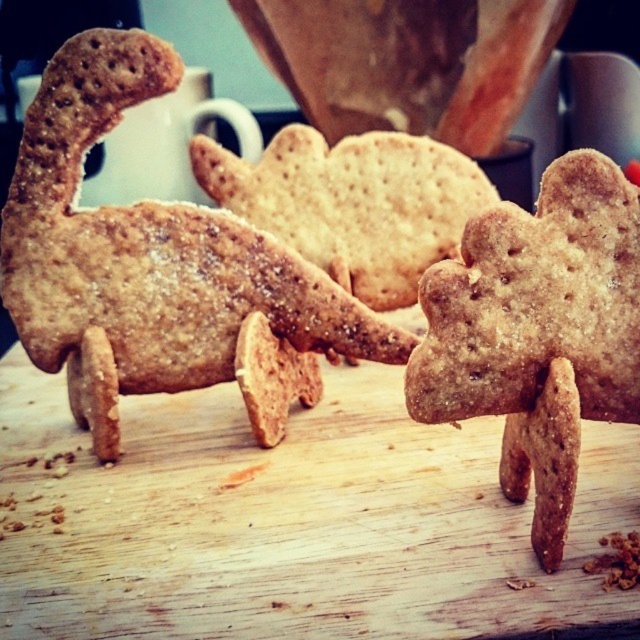
Is wooden cutting board at center taller than golden brown crumbly gingerbread at center?

In fact, wooden cutting board at center may be shorter than golden brown crumbly gingerbread at center.

Between point (593, 605) and point (552, 326), which one is positioned in front?

Positioned in front is point (593, 605).

Is point (620, 596) positioned in front of point (454, 305)?

Yes, point (620, 596) is closer to viewer.

This screenshot has height=640, width=640. In order to click on wooden cutting board at center in this screenshot , I will do `click(291, 522)`.

Can you confirm if matte brown cookie at center is positioned to the left of golden brown crumbly gingerbread at center?

Yes, matte brown cookie at center is to the left of golden brown crumbly gingerbread at center.

You are a GUI agent. You are given a task and a screenshot of the screen. Output one action in this format:
    pyautogui.click(x=<x>, y=<y>)
    Task: Click on the matte brown cookie at center
    The width and height of the screenshot is (640, 640).
    Given the screenshot: What is the action you would take?
    [x=157, y=268]

Does point (356, 321) lie in front of point (484, 275)?

That is False.

What are the coordinates of `matte brown cookie at center` in the screenshot? It's located at (157, 268).

Who is higher up, wooden cutting board at center or matte brown cookie at center?

matte brown cookie at center is higher up.

Who is shorter, wooden cutting board at center or matte brown cookie at center?

With less height is wooden cutting board at center.

Is point (355, 451) positioned before point (49, 205)?

No.

Locate an element on the screen. wooden cutting board at center is located at coordinates (291, 522).